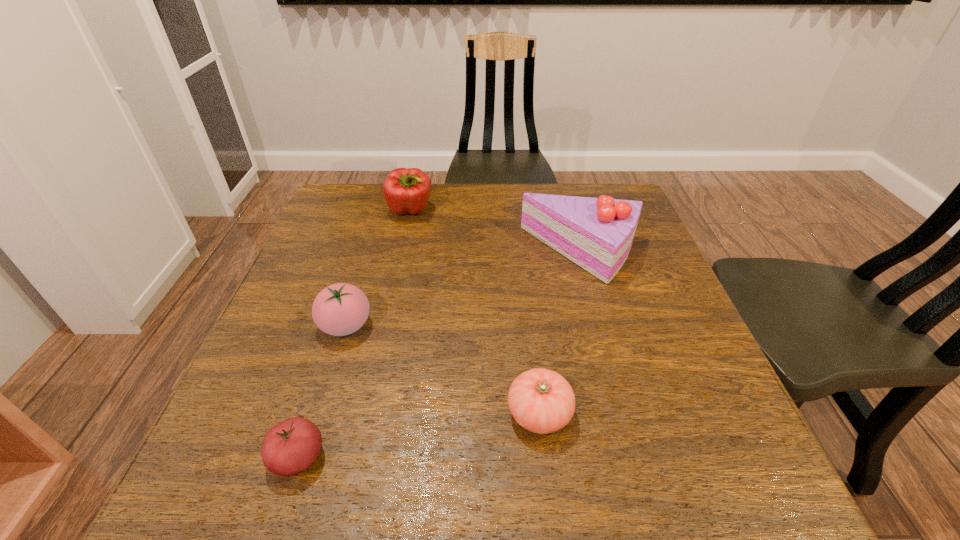
Find the location of a particular element. This screenshot has width=960, height=540. object present at the near edge is located at coordinates (290, 447).

Where is `object at the right edge`? This screenshot has height=540, width=960. object at the right edge is located at coordinates (595, 233).

Locate an element on the screen. The image size is (960, 540). object present at the near left corner is located at coordinates (290, 447).

Image resolution: width=960 pixels, height=540 pixels. Identify the location of vacant point at the far edge. (540, 192).

In the image, there is a desktop. Where is `vacant region at the left edge`? This screenshot has height=540, width=960. vacant region at the left edge is located at coordinates (243, 413).

Find the location of a particular element. The height and width of the screenshot is (540, 960). free space at the right edge of the desktop is located at coordinates (644, 314).

Identify the location of vacant area at the far left corner of the desktop. This screenshot has height=540, width=960. (371, 193).

Image resolution: width=960 pixels, height=540 pixels. I want to click on vacant position at the near right corner of the desktop, so point(742,474).

Locate an element on the screen. This screenshot has width=960, height=540. free spot between the rightmost tomato and the cake is located at coordinates (561, 334).

Where is `free space between the farthest object and the tallest tomato`? The width and height of the screenshot is (960, 540). free space between the farthest object and the tallest tomato is located at coordinates (378, 268).